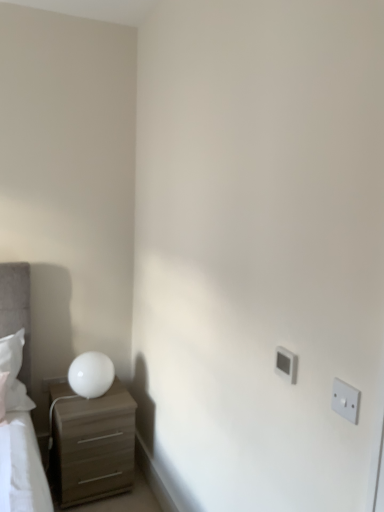
Question: Is matte brown chest of drawers at lower left at the back of white plastic electric outlet at right, the first electric outlet when ordered from front to back?

Choices:
 (A) no
 (B) yes

Answer: (A)

Question: Considering the relative sizes of white plastic electric outlet at right, arranged as the second electric outlet when viewed from the left, and matte brown chest of drawers at lower left in the image provided, is white plastic electric outlet at right, arranged as the second electric outlet when viewed from the left, thinner than matte brown chest of drawers at lower left?

Choices:
 (A) yes
 (B) no

Answer: (A)

Question: Is matte brown chest of drawers at lower left located within white plastic electric outlet at right, the first electric outlet when ordered from front to back?

Choices:
 (A) yes
 (B) no

Answer: (B)

Question: From a real-world perspective, is white plastic electric outlet at right, the first electric outlet when ordered from front to back, located higher than matte brown chest of drawers at lower left?

Choices:
 (A) yes
 (B) no

Answer: (A)

Question: From the image's perspective, does white plastic electric outlet at right, arranged as the second electric outlet when viewed from the left, appear lower than matte brown chest of drawers at lower left?

Choices:
 (A) yes
 (B) no

Answer: (B)

Question: Looking at their shapes, would you say white plastic electric outlet at right, the 1th electric outlet when ordered from right to left, is wider or thinner than white plastic electric outlet at upper right, the 2th electric outlet in the front-to-back sequence?

Choices:
 (A) wide
 (B) thin

Answer: (B)

Question: Considering their positions, is white plastic electric outlet at right, the 1th electric outlet when ordered from right to left, located in front of or behind white plastic electric outlet at upper right, the second electric outlet positioned from the right?

Choices:
 (A) behind
 (B) front

Answer: (B)

Question: From the image's perspective, is white plastic electric outlet at right, the first electric outlet when ordered from front to back, located above or below white plastic electric outlet at upper right, the second electric outlet positioned from the right?

Choices:
 (A) below
 (B) above

Answer: (A)

Question: Is white plastic electric outlet at right, acting as the 2th electric outlet starting from the back, taller or shorter than white plastic electric outlet at upper right, the second electric outlet positioned from the right?

Choices:
 (A) short
 (B) tall

Answer: (B)

Question: Considering the positions of white glossy table lamp at left and matte brown chest of drawers at lower left in the image, is white glossy table lamp at left taller or shorter than matte brown chest of drawers at lower left?

Choices:
 (A) tall
 (B) short

Answer: (B)

Question: Is white glossy table lamp at left wider or thinner than matte brown chest of drawers at lower left?

Choices:
 (A) thin
 (B) wide

Answer: (A)

Question: Looking at the image, does white glossy table lamp at left seem bigger or smaller compared to matte brown chest of drawers at lower left?

Choices:
 (A) small
 (B) big

Answer: (A)

Question: Is white glossy table lamp at left situated inside matte brown chest of drawers at lower left or outside?

Choices:
 (A) inside
 (B) outside

Answer: (B)

Question: Is point (74, 376) positioned closer to the camera than point (347, 397)?

Choices:
 (A) farther
 (B) closer

Answer: (A)

Question: Is white glossy table lamp at left inside or outside of white plastic electric outlet at right, acting as the 2th electric outlet starting from the back?

Choices:
 (A) outside
 (B) inside

Answer: (A)